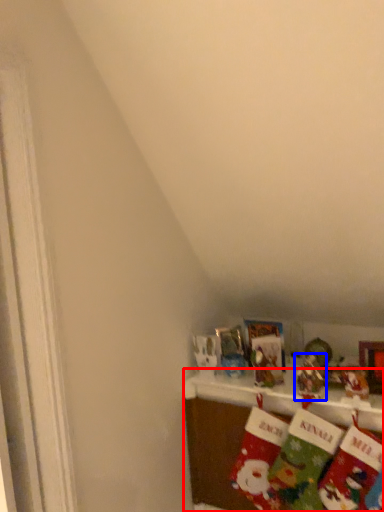
Question: Which of the following is the farthest to the observer, shelf (highlighted by a red box) or toy (highlighted by a blue box)?

Choices:
 (A) shelf
 (B) toy

Answer: (B)